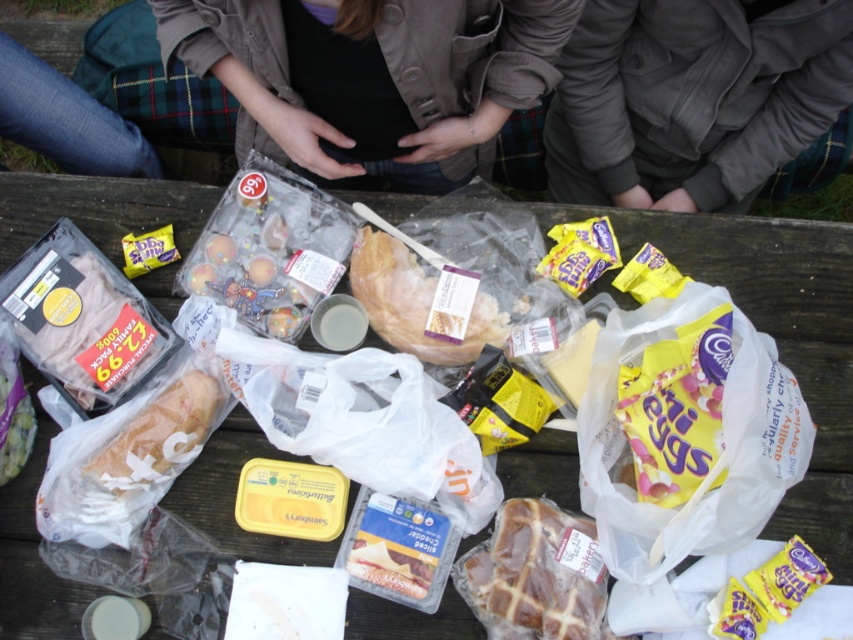
Question: Considering the real-world distances, which object is closest to the matte brown bread at center?

Choices:
 (A) yellow foil chocolate at lower right
 (B) golden brown glazed hot cross bun at center
 (C) black fabric shirt at center
 (D) white bread at center

Answer: (C)

Question: Estimate the real-world distances between objects in this image. Which object is closer to the wooden picnic table at center?

Choices:
 (A) yellow foil chocolate at lower right
 (B) golden brown glazed hot cross bun at center
 (C) white bread at center

Answer: (B)

Question: Among these objects, which one is nearest to the camera?

Choices:
 (A) gray fabric jacket at upper center
 (B) matte brown bread at center
 (C) white bread at center
 (D) wooden picnic table at center

Answer: (A)

Question: Is wooden picnic table at center to the left of gray fabric jacket at upper center from the viewer's perspective?

Choices:
 (A) yes
 (B) no

Answer: (A)

Question: Is golden brown glazed hot cross bun at center smaller than yellow foil chocolate at lower right?

Choices:
 (A) no
 (B) yes

Answer: (A)

Question: Where is yellow foil chocolate at lower right located in relation to white bread at center in the image?

Choices:
 (A) above
 (B) below

Answer: (B)